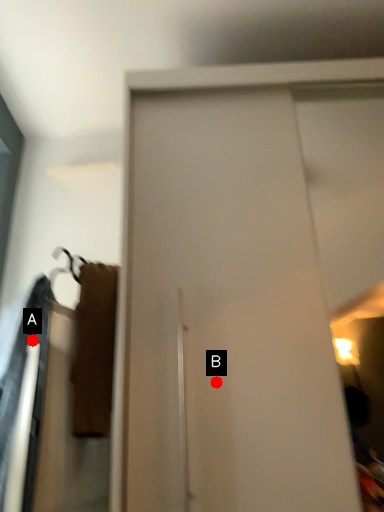
Question: Two points are circled on the image, labeled by A and B beside each circle. Which of the following is the closest to the observer?

Choices:
 (A) A is closer
 (B) B is closer

Answer: (B)